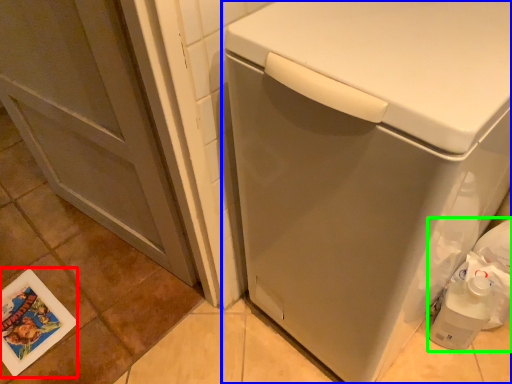
Question: Which object is positioned farthest from postcard (highlighted by a red box)? Select from washing machine (highlighted by a blue box) and garbage (highlighted by a green box).

Choices:
 (A) washing machine
 (B) garbage

Answer: (B)